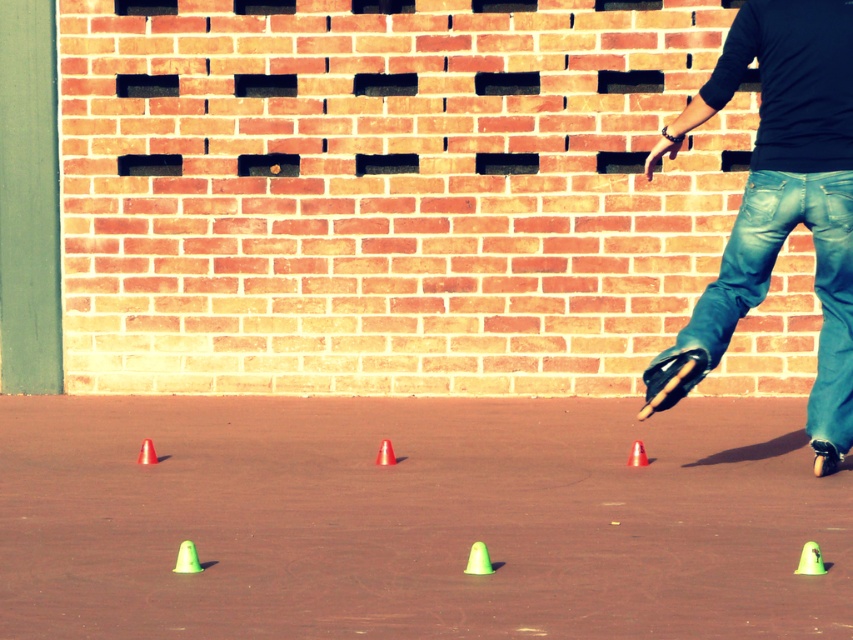
Does green matte traffic cone at lower right have a larger size compared to green matte traffic cone at center?

Incorrect, green matte traffic cone at lower right is not larger than green matte traffic cone at center.

The image size is (853, 640). In order to click on green matte traffic cone at lower right in this screenshot , I will do `click(810, 560)`.

The image size is (853, 640). What are the coordinates of `green matte traffic cone at lower right` in the screenshot? It's located at (810, 560).

Between green matte traffic cone at center and green matte traffic cone at lower left, which one has less height?

green matte traffic cone at lower left is shorter.

Is green matte traffic cone at center closer to camera compared to green matte traffic cone at lower left?

Yes, green matte traffic cone at center is closer to the viewer.

Who is more forward, (473, 554) or (194, 570)?

Positioned in front is point (473, 554).

Find the location of `green matte traffic cone at center`. green matte traffic cone at center is located at coordinates (479, 560).

Is the position of green matte traffic cone at lower right less distant than that of orange plastic cone at lower left?

Yes.

Can you confirm if green matte traffic cone at lower right is positioned below orange plastic cone at lower left?

Indeed, green matte traffic cone at lower right is positioned under orange plastic cone at lower left.

Where is `green matte traffic cone at lower right`? The image size is (853, 640). green matte traffic cone at lower right is located at coordinates (810, 560).

Where is `green matte traffic cone at lower right`? The width and height of the screenshot is (853, 640). green matte traffic cone at lower right is located at coordinates (810, 560).